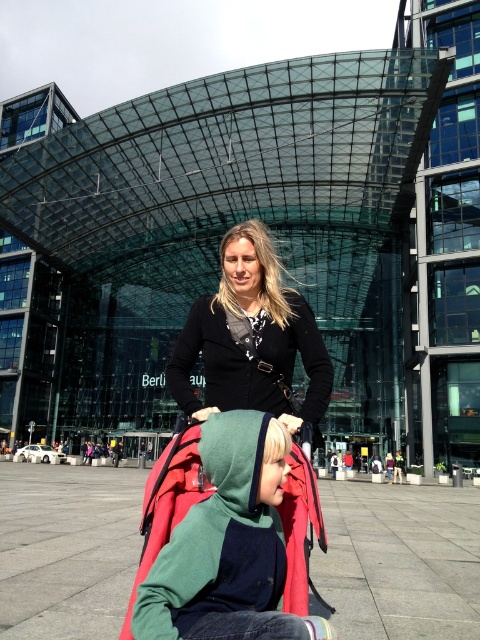
Is green fleece jacket at center taller than black matte cardigan at center?

No, green fleece jacket at center is not taller than black matte cardigan at center.

Is point (240, 612) positioned in front of point (228, 353)?

Yes, it is in front of point (228, 353).

Find the location of a particular element. Image resolution: width=480 pixels, height=640 pixels. green fleece jacket at center is located at coordinates (228, 545).